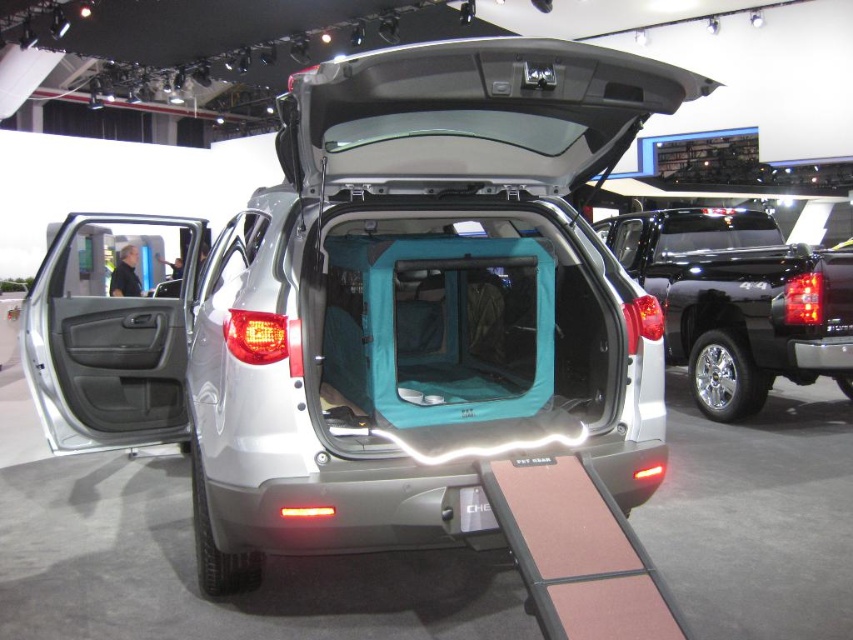
Question: Can you confirm if satin silver car at center is bigger than satin black truck at center?

Choices:
 (A) yes
 (B) no

Answer: (B)

Question: Which of the following is the closest to the observer?

Choices:
 (A) (709, 321)
 (B) (376, 294)

Answer: (B)

Question: Among these points, which one is farthest from the camera?

Choices:
 (A) (109, 445)
 (B) (755, 333)

Answer: (B)

Question: From the image, what is the correct spatial relationship of satin silver car at center in relation to satin black truck at center?

Choices:
 (A) left
 (B) right

Answer: (A)

Question: Is satin silver car at center closer to camera compared to satin black truck at center?

Choices:
 (A) no
 (B) yes

Answer: (B)